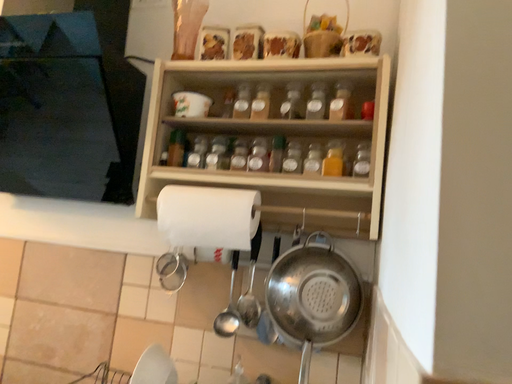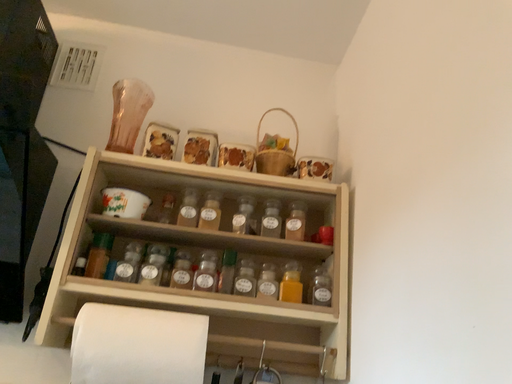
Question: Which way did the camera rotate in the video?

Choices:
 (A) rotated downward
 (B) rotated upward

Answer: (B)